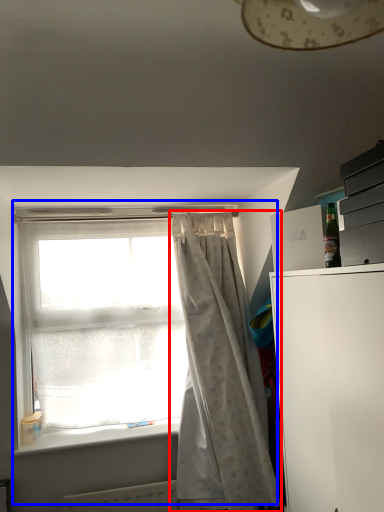
Question: Which object is closer to the camera taking this photo, curtain (highlighted by a red box) or window (highlighted by a blue box)?

Choices:
 (A) curtain
 (B) window

Answer: (A)